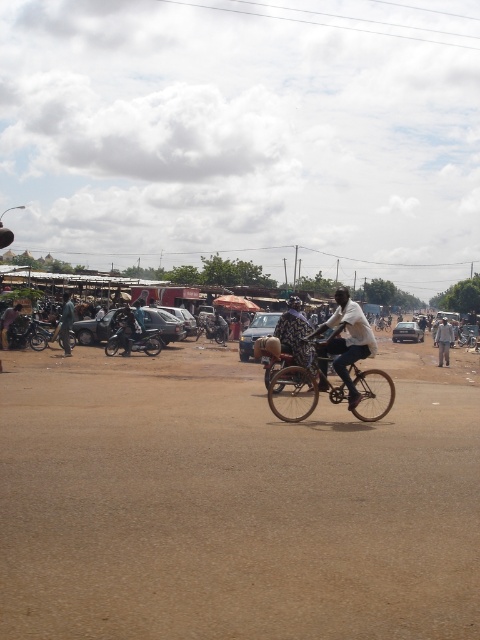
Question: Based on their relative distances, which object is nearer to the dark gray fabric pants at right?

Choices:
 (A) dark brown leather bicycle at center
 (B) metallic silver bicycle at center

Answer: (A)

Question: Does brown dirt field at center lie behind dark gray fabric pants at right?

Choices:
 (A) yes
 (B) no

Answer: (B)

Question: Observing the image, what is the correct spatial positioning of brown dirt field at center in reference to dark brown leather bicycle at center?

Choices:
 (A) left
 (B) right

Answer: (A)

Question: Which point is closer to the camera?

Choices:
 (A) (442, 344)
 (B) (291, 369)
 (C) (90, 536)
 (D) (126, 342)

Answer: (C)

Question: Does brown dirt field at center appear on the left side of metallic silver bicycle at center?

Choices:
 (A) yes
 (B) no

Answer: (B)

Question: Which point appears farthest from the camera in this image?

Choices:
 (A) (444, 337)
 (B) (336, 324)
 (C) (137, 333)
 (D) (11, 460)

Answer: (A)